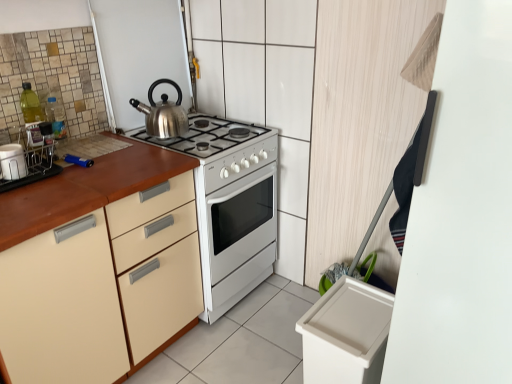
Question: Could satin silver kettle at upper center be considered to be inside matte white container at left?

Choices:
 (A) no
 (B) yes

Answer: (A)

Question: Are matte white container at left and satin silver kettle at upper center located far from each other?

Choices:
 (A) no
 (B) yes

Answer: (A)

Question: Does matte white container at left have a smaller size compared to satin silver kettle at upper center?

Choices:
 (A) yes
 (B) no

Answer: (A)

Question: Considering the relative sizes of matte white container at left and satin silver kettle at upper center in the image provided, is matte white container at left wider than satin silver kettle at upper center?

Choices:
 (A) yes
 (B) no

Answer: (B)

Question: From a real-world perspective, is matte white container at left physically below satin silver kettle at upper center?

Choices:
 (A) no
 (B) yes

Answer: (B)

Question: In the image, is satin silver kettle at upper center on the left side or the right side of matte wood cabinet at left?

Choices:
 (A) left
 (B) right

Answer: (B)

Question: From a real-world perspective, is satin silver kettle at upper center physically located above or below matte wood cabinet at left?

Choices:
 (A) above
 (B) below

Answer: (A)

Question: In the image, is satin silver kettle at upper center positioned in front of or behind matte wood cabinet at left?

Choices:
 (A) front
 (B) behind

Answer: (B)

Question: Looking at the image, does satin silver kettle at upper center seem bigger or smaller compared to matte wood cabinet at left?

Choices:
 (A) big
 (B) small

Answer: (B)

Question: In the image, is white glossy stove at center positioned in front of or behind matte white container at left?

Choices:
 (A) behind
 (B) front

Answer: (A)

Question: Based on their sizes in the image, would you say white glossy stove at center is bigger or smaller than matte white container at left?

Choices:
 (A) small
 (B) big

Answer: (B)

Question: Considering the positions of white glossy stove at center and matte white container at left in the image, is white glossy stove at center wider or thinner than matte white container at left?

Choices:
 (A) thin
 (B) wide

Answer: (B)

Question: Choose the correct answer: Is white glossy stove at center inside matte white container at left or outside it?

Choices:
 (A) outside
 (B) inside

Answer: (A)

Question: Visually, is satin silver kettle at upper center positioned to the left or to the right of matte white container at left?

Choices:
 (A) left
 (B) right

Answer: (B)

Question: In terms of height, does satin silver kettle at upper center look taller or shorter compared to matte white container at left?

Choices:
 (A) tall
 (B) short

Answer: (A)